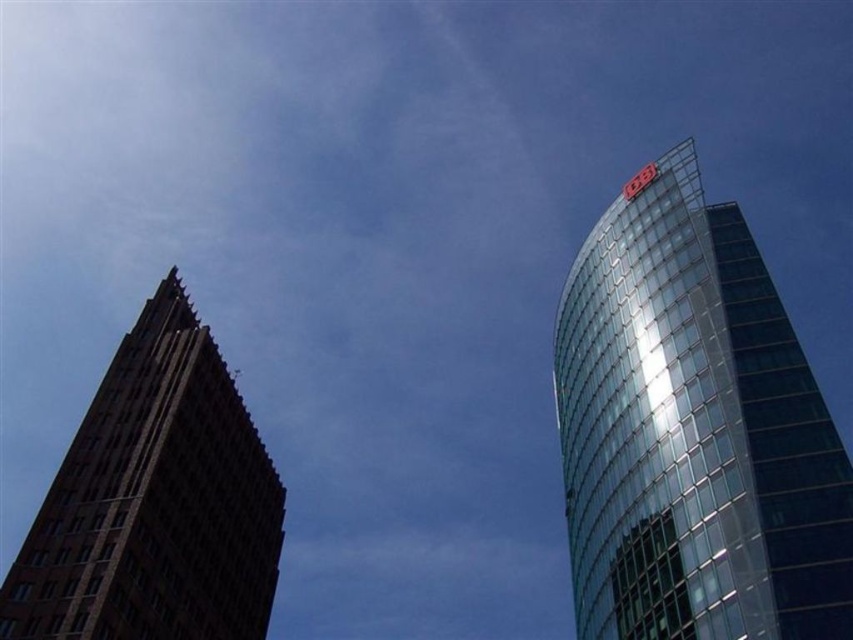
Which of these two, transparent glass tower at right or brown brick building at left, stands taller?

Standing taller between the two is brown brick building at left.

Between transparent glass tower at right and brown brick building at left, which one has less height?

transparent glass tower at right is shorter.

Which is behind, point (683, 337) or point (131, 364)?

Positioned behind is point (131, 364).

Image resolution: width=853 pixels, height=640 pixels. In order to click on transparent glass tower at right in this screenshot , I will do `click(693, 432)`.